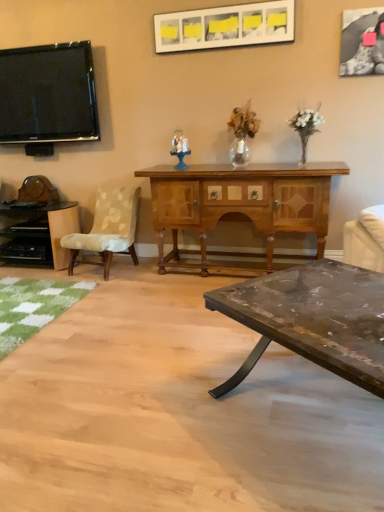
Find the location of a particular element. This screenshot has width=384, height=512. free spot above rustic wood coffee table at lower right (from a real-world perspective) is located at coordinates (330, 300).